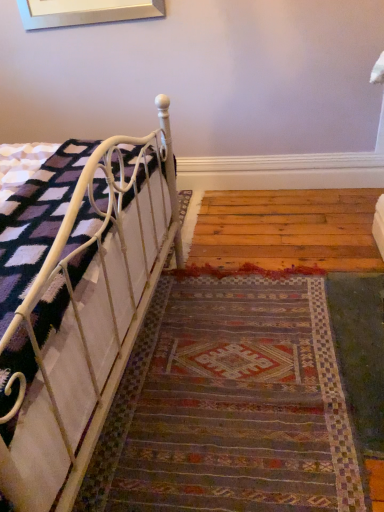
The image size is (384, 512). Describe the element at coordinates (76, 301) in the screenshot. I see `white metal bed at left` at that location.

Image resolution: width=384 pixels, height=512 pixels. In order to click on white metal bed at left in this screenshot , I will do `click(76, 301)`.

The height and width of the screenshot is (512, 384). I want to click on multicolored woven rug at center, so click(230, 405).

Measure the distance between point (137, 509) and camera.

Point (137, 509) and camera are 1.16 meters apart from each other.

What is the approximate height of multicolored woven rug at center?

It is 2.89 inches.

What do you see at coordinates (230, 405) in the screenshot?
I see `multicolored woven rug at center` at bounding box center [230, 405].

Locate an element on the screen. white metal bed at left is located at coordinates (76, 301).

Considering the positions of objects white metal bed at left and multicolored woven rug at center in the image provided, who is more to the right, white metal bed at left or multicolored woven rug at center?

Positioned to the right is multicolored woven rug at center.

In the image, is white metal bed at left positioned in front of or behind multicolored woven rug at center?

white metal bed at left is in front of multicolored woven rug at center.

Between point (26, 190) and point (331, 438), which one is positioned behind?

The point (26, 190) is farther from the camera.

From the picture: From the image's perspective, does white metal bed at left appear higher than multicolored woven rug at center?

Correct, white metal bed at left appears higher than multicolored woven rug at center in the image.

From a real-world perspective, does white metal bed at left stand above multicolored woven rug at center?

Indeed, from a real-world perspective, white metal bed at left stands above multicolored woven rug at center.

Between white metal bed at left and multicolored woven rug at center, which one has smaller width?

white metal bed at left is thinner.

Consider the image. Which of these two, white metal bed at left or multicolored woven rug at center, stands shorter?

Standing shorter between the two is multicolored woven rug at center.

Consider the image. Is white metal bed at left bigger or smaller than multicolored woven rug at center?

In the image, white metal bed at left appears to be larger than multicolored woven rug at center.

Is white metal bed at left outside of multicolored woven rug at center?

Indeed, white metal bed at left is completely outside multicolored woven rug at center.

Is white metal bed at left beside multicolored woven rug at center?

white metal bed at left and multicolored woven rug at center are not in contact.

Is white metal bed at left oriented away from multicolored woven rug at center?

white metal bed at left is not turned away from multicolored woven rug at center.

What's the angular difference between white metal bed at left and multicolored woven rug at center's facing directions?

There is a 178-degree angle between the facing directions of white metal bed at left and multicolored woven rug at center.

In the image, there is a white metal bed at left. Where is `doormat below it (from a real-world perspective)`? Image resolution: width=384 pixels, height=512 pixels. doormat below it (from a real-world perspective) is located at coordinates (230, 405).

Which is more to the left, multicolored woven rug at center or white metal bed at left?

Positioned to the left is white metal bed at left.

Is multicolored woven rug at center in front of or behind white metal bed at left in the image?

multicolored woven rug at center is behind white metal bed at left.

Which is in front, point (191, 312) or point (44, 163)?

The point (44, 163) is closer to the camera.

From the image's perspective, who appears lower, multicolored woven rug at center or white metal bed at left?

multicolored woven rug at center is shown below in the image.

From a real-world perspective, between multicolored woven rug at center and white metal bed at left, who is vertically higher?

In real-world perspective, white metal bed at left is above.

Is multicolored woven rug at center wider than white metal bed at left?

Correct, the width of multicolored woven rug at center exceeds that of white metal bed at left.

Is multicolored woven rug at center taller than white metal bed at left?

No.

Who is bigger, multicolored woven rug at center or white metal bed at left?

Bigger between the two is white metal bed at left.

Is multicolored woven rug at center inside the boundaries of white metal bed at left, or outside?

multicolored woven rug at center exists outside the volume of white metal bed at left.

Is multicolored woven rug at center touching white metal bed at left?

No, multicolored woven rug at center is not in contact with white metal bed at left.

Is multicolored woven rug at center positioned with its back to white metal bed at left?

No, white metal bed at left is not at the back of multicolored woven rug at center.

What's the angular difference between multicolored woven rug at center and white metal bed at left's facing directions?

multicolored woven rug at center and white metal bed at left are facing 178 degrees away from each other.

What are the coordinates of `bed above the multicolored woven rug at center (from a real-world perspective)` in the screenshot? It's located at (76, 301).

Where is `doormat below the white metal bed at left (from the image's perspective)`? The width and height of the screenshot is (384, 512). doormat below the white metal bed at left (from the image's perspective) is located at coordinates (230, 405).

The width and height of the screenshot is (384, 512). I want to click on doormat on the right side of white metal bed at left, so click(x=230, y=405).